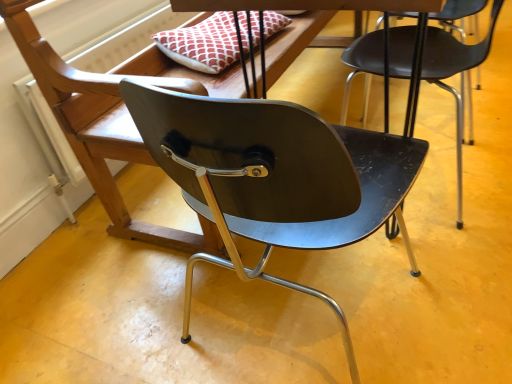
Question: Is matte black chair at center, which is the second chair in right-to-left order, inside or outside of matte black chair at center, acting as the second chair starting from the left?

Choices:
 (A) inside
 (B) outside

Answer: (B)

Question: Is matte black chair at center, which is the second chair in right-to-left order, to the left or to the right of matte black chair at center, acting as the second chair starting from the left, in the image?

Choices:
 (A) left
 (B) right

Answer: (A)

Question: Is point (132, 145) closer or farther from the camera than point (492, 34)?

Choices:
 (A) closer
 (B) farther

Answer: (A)

Question: Is matte black chair at center, which ranks as the first chair in right-to-left order, inside or outside of matte black chair at center, which is the second chair in right-to-left order?

Choices:
 (A) outside
 (B) inside

Answer: (A)

Question: From a real-world perspective, is matte black chair at center, acting as the second chair starting from the left, positioned above or below matte black chair at center, the 1th chair viewed from the left?

Choices:
 (A) above
 (B) below

Answer: (B)

Question: Considering the positions of matte black chair at center, acting as the second chair starting from the left, and matte black chair at center, which is the second chair in right-to-left order, in the image, is matte black chair at center, acting as the second chair starting from the left, wider or thinner than matte black chair at center, which is the second chair in right-to-left order,?

Choices:
 (A) thin
 (B) wide

Answer: (A)

Question: From the image's perspective, is matte black chair at center, which ranks as the first chair in right-to-left order, above or below matte black chair at center, the 1th chair viewed from the left?

Choices:
 (A) below
 (B) above

Answer: (B)